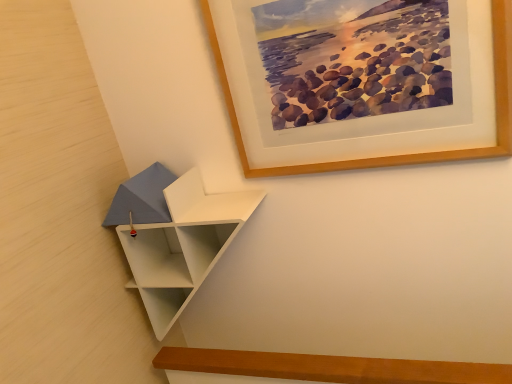
Question: Relative to wooden picture frame at upper center, is white matte/shelf at lower left in front or behind?

Choices:
 (A) front
 (B) behind

Answer: (B)

Question: In terms of height, does white matte/shelf at lower left look taller or shorter compared to wooden picture frame at upper center?

Choices:
 (A) short
 (B) tall

Answer: (B)

Question: Considering the positions of point (138, 251) and point (495, 3), is point (138, 251) closer or farther from the camera than point (495, 3)?

Choices:
 (A) closer
 (B) farther

Answer: (B)

Question: In terms of width, does wooden picture frame at upper center look wider or thinner when compared to white matte/shelf at lower left?

Choices:
 (A) wide
 (B) thin

Answer: (B)

Question: Is wooden picture frame at upper center situated inside white matte/shelf at lower left or outside?

Choices:
 (A) outside
 (B) inside

Answer: (A)

Question: Visually, is wooden picture frame at upper center positioned to the left or to the right of white matte/shelf at lower left?

Choices:
 (A) left
 (B) right

Answer: (B)

Question: Considering the positions of point (506, 74) and point (194, 254), is point (506, 74) closer or farther from the camera than point (194, 254)?

Choices:
 (A) farther
 (B) closer

Answer: (B)